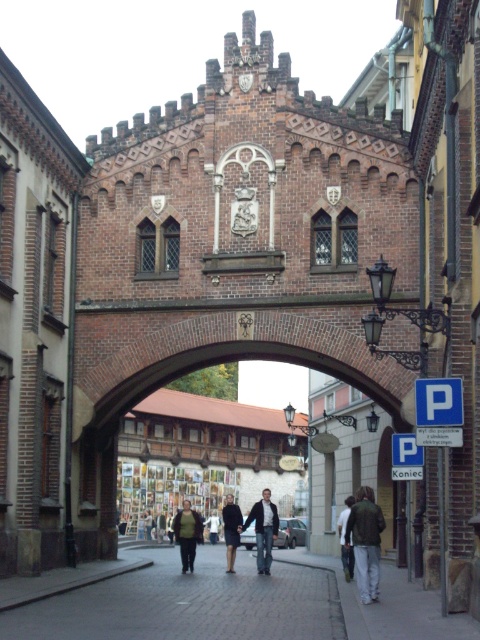
Who is more forward, [271,532] or [342,557]?

Point [271,532] is more forward.

Is dark blue jeans at center taller than dark gray jacket at center?

Yes, dark blue jeans at center is taller than dark gray jacket at center.

Is point (271, 531) farther from camera compared to point (340, 552)?

No, (271, 531) is in front of (340, 552).

Locate an element on the screen. Image resolution: width=480 pixels, height=640 pixels. dark blue jeans at center is located at coordinates (264, 529).

Based on the photo, is matte black coat at center to the right of dark blue dress at center from the viewer's perspective?

→ Indeed, matte black coat at center is positioned on the right side of dark blue dress at center.

Is matte black coat at center taller than dark blue dress at center?

Indeed, matte black coat at center has a greater height compared to dark blue dress at center.

Does point (199, 531) come farther from viewer compared to point (213, 532)?

No.

This screenshot has width=480, height=640. I want to click on matte black coat at center, so click(188, 532).

What do you see at coordinates (406, 458) in the screenshot?
I see `blue plastic parking sign at center` at bounding box center [406, 458].

Where is `blue plastic parking sign at center`? The width and height of the screenshot is (480, 640). blue plastic parking sign at center is located at coordinates (406, 458).